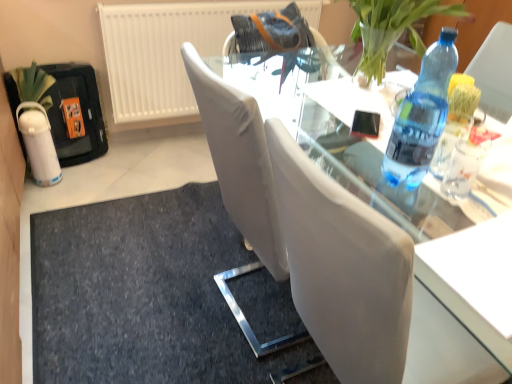
Question: From a real-world perspective, is transparent glass table at center beneath blue plastic bottle at right?

Choices:
 (A) yes
 (B) no

Answer: (A)

Question: Does transparent glass table at center have a larger size compared to blue plastic bottle at right?

Choices:
 (A) no
 (B) yes

Answer: (B)

Question: From the image's perspective, is transparent glass table at center below blue plastic bottle at right?

Choices:
 (A) yes
 (B) no

Answer: (A)

Question: Can we say transparent glass table at center lies outside blue plastic bottle at right?

Choices:
 (A) yes
 (B) no

Answer: (A)

Question: Is the depth of transparent glass table at center less than that of blue plastic bottle at right?

Choices:
 (A) yes
 (B) no

Answer: (A)

Question: Is transparent glass table at center positioned with its back to blue plastic bottle at right?

Choices:
 (A) no
 (B) yes

Answer: (A)

Question: Is dark gray fabric doormat at lower center turned away from transparent glass table at center?

Choices:
 (A) no
 (B) yes

Answer: (A)

Question: From the image's perspective, is dark gray fabric doormat at lower center located beneath transparent glass table at center?

Choices:
 (A) no
 (B) yes

Answer: (B)

Question: Can you confirm if dark gray fabric doormat at lower center is bigger than transparent glass table at center?

Choices:
 (A) no
 (B) yes

Answer: (A)

Question: Is the depth of dark gray fabric doormat at lower center less than that of transparent glass table at center?

Choices:
 (A) no
 (B) yes

Answer: (A)

Question: From a real-world perspective, is dark gray fabric doormat at lower center under transparent glass table at center?

Choices:
 (A) no
 (B) yes

Answer: (B)

Question: Is dark gray fabric doormat at lower center aimed at transparent glass table at center?

Choices:
 (A) yes
 (B) no

Answer: (B)

Question: Is transparent glass table at center positioned with its back to white textured radiator at upper left?

Choices:
 (A) yes
 (B) no

Answer: (B)